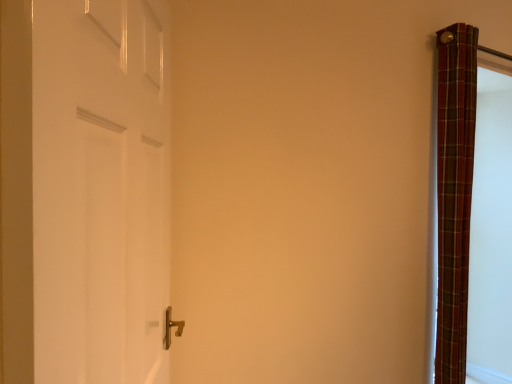
Question: Can you confirm if plaid fabric curtain at right is bigger than white glossy door at left?

Choices:
 (A) yes
 (B) no

Answer: (B)

Question: Is plaid fabric curtain at right facing away from white glossy door at left?

Choices:
 (A) no
 (B) yes

Answer: (A)

Question: Considering the relative sizes of plaid fabric curtain at right and white glossy door at left in the image provided, is plaid fabric curtain at right shorter than white glossy door at left?

Choices:
 (A) yes
 (B) no

Answer: (B)

Question: Does plaid fabric curtain at right have a greater width compared to white glossy door at left?

Choices:
 (A) no
 (B) yes

Answer: (B)

Question: Is plaid fabric curtain at right in front of white glossy door at left?

Choices:
 (A) no
 (B) yes

Answer: (A)

Question: Can you confirm if plaid fabric curtain at right is thinner than white glossy door at left?

Choices:
 (A) yes
 (B) no

Answer: (B)

Question: From a real-world perspective, is white glossy door at left located beneath plaid fabric curtain at right?

Choices:
 (A) no
 (B) yes

Answer: (A)

Question: Does white glossy door at left have a lesser width compared to plaid fabric curtain at right?

Choices:
 (A) no
 (B) yes

Answer: (B)

Question: From the image's perspective, is white glossy door at left under plaid fabric curtain at right?

Choices:
 (A) yes
 (B) no

Answer: (B)

Question: Is the surface of white glossy door at left in direct contact with plaid fabric curtain at right?

Choices:
 (A) yes
 (B) no

Answer: (B)

Question: Is white glossy door at left not inside plaid fabric curtain at right?

Choices:
 (A) no
 (B) yes

Answer: (B)

Question: Can you confirm if white glossy door at left is positioned to the right of plaid fabric curtain at right?

Choices:
 (A) yes
 (B) no

Answer: (B)

Question: Choose the correct answer: Is white glossy door at left inside plaid fabric curtain at right or outside it?

Choices:
 (A) outside
 (B) inside

Answer: (A)